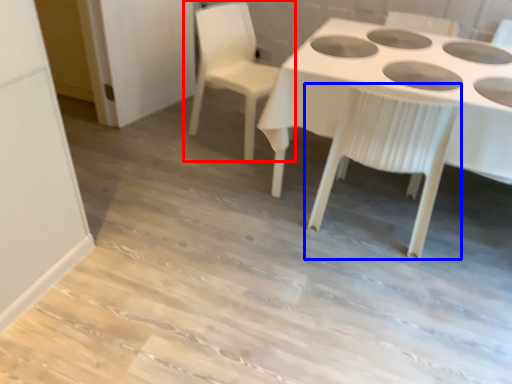
Question: Which object is closer to the camera taking this photo, chair (highlighted by a red box) or chair (highlighted by a blue box)?

Choices:
 (A) chair
 (B) chair

Answer: (B)